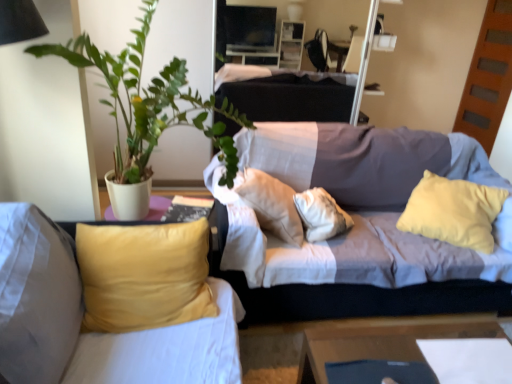
Question: Would you say wooden table at lower right is a long distance from velvet yellow pillow at left, the 1th studio couch positioned from the left?

Choices:
 (A) no
 (B) yes

Answer: (A)

Question: Does wooden table at lower right have a greater width compared to velvet yellow pillow at left, the 1th studio couch positioned from the left?

Choices:
 (A) yes
 (B) no

Answer: (A)

Question: Is wooden table at lower right to the left of velvet yellow pillow at left, the 1th studio couch positioned from the left, from the viewer's perspective?

Choices:
 (A) yes
 (B) no

Answer: (B)

Question: Considering the relative sizes of wooden table at lower right and velvet yellow pillow at left, the 1th studio couch positioned from the left, in the image provided, is wooden table at lower right smaller than velvet yellow pillow at left, the 1th studio couch positioned from the left,?

Choices:
 (A) yes
 (B) no

Answer: (A)

Question: Could you tell me if wooden table at lower right is turned towards velvet yellow pillow at left, which ranks as the 2th studio couch in right-to-left order?

Choices:
 (A) no
 (B) yes

Answer: (A)

Question: From the image's perspective, is wooden table at lower right below velvet yellow pillow at left, which ranks as the 2th studio couch in right-to-left order?

Choices:
 (A) no
 (B) yes

Answer: (B)

Question: From the image's perspective, would you say textured gray couch at center, the 1th studio couch from the right, is positioned over velvet yellow pillow at left, which ranks as the 2th studio couch in right-to-left order?

Choices:
 (A) yes
 (B) no

Answer: (A)

Question: Is textured gray couch at center, the 1th studio couch from the right, not close to velvet yellow pillow at left, the 1th studio couch positioned from the left?

Choices:
 (A) no
 (B) yes

Answer: (A)

Question: Is the depth of textured gray couch at center, the 1th studio couch from the right, greater than that of velvet yellow pillow at left, which ranks as the 2th studio couch in right-to-left order?

Choices:
 (A) no
 (B) yes

Answer: (B)

Question: Does textured gray couch at center, the 1th studio couch from the right, have a larger size compared to velvet yellow pillow at left, the 1th studio couch positioned from the left?

Choices:
 (A) no
 (B) yes

Answer: (B)

Question: Could you tell me if textured gray couch at center, the 1th studio couch from the right, is facing velvet yellow pillow at left, which ranks as the 2th studio couch in right-to-left order?

Choices:
 (A) no
 (B) yes

Answer: (A)

Question: Are textured gray couch at center, which is counted as the 2th studio couch, starting from the left, and velvet yellow pillow at left, the 1th studio couch positioned from the left, beside each other?

Choices:
 (A) no
 (B) yes

Answer: (A)

Question: From the image's perspective, does velvet yellow pillow at left, which ranks as the 2th studio couch in right-to-left order, appear higher than wooden table at lower right?

Choices:
 (A) yes
 (B) no

Answer: (A)